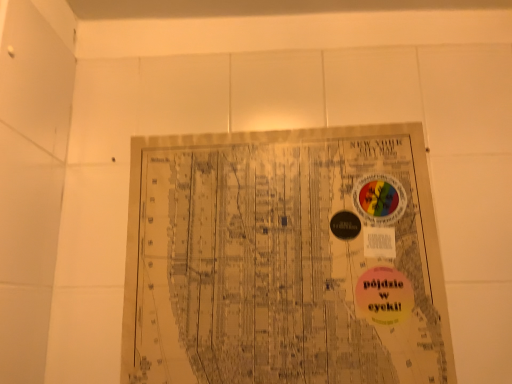
Image resolution: width=512 pixels, height=384 pixels. What do you see at coordinates (284, 260) in the screenshot?
I see `beige paper map at center` at bounding box center [284, 260].

Where is `beige paper map at center`? The height and width of the screenshot is (384, 512). beige paper map at center is located at coordinates (284, 260).

Locate an element on the screen. The width and height of the screenshot is (512, 384). beige paper map at center is located at coordinates (284, 260).